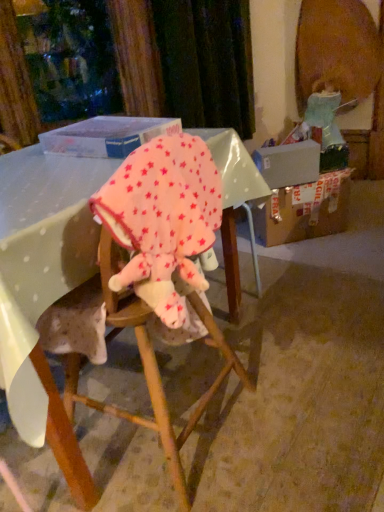
Where is `pink fleece baby elephant at center`? pink fleece baby elephant at center is located at coordinates (162, 219).

Image resolution: width=384 pixels, height=512 pixels. Describe the element at coordinates (304, 210) in the screenshot. I see `brown cardboard box at right` at that location.

The image size is (384, 512). What are the coordinates of `brown cardboard box at right` in the screenshot? It's located at [304, 210].

The width and height of the screenshot is (384, 512). I want to click on pink fleece blanket at center, so click(144, 350).

In the scene shown: How far apart are pink fleece blanket at center and translucent plastic box at upper center?

They are 21.10 inches apart.

Which of these two, pink fleece blanket at center or translucent plastic box at upper center, stands taller?

pink fleece blanket at center is taller.

Between pink fleece blanket at center and translucent plastic box at upper center, which one appears on the right side from the viewer's perspective?

pink fleece blanket at center.

Does pink fleece blanket at center lie behind translucent plastic box at upper center?

No, the depth of pink fleece blanket at center is less than that of translucent plastic box at upper center.

Consider the image. Is brown cardboard box at right to the right of pink fleece blanket at center from the viewer's perspective?

Indeed, brown cardboard box at right is positioned on the right side of pink fleece blanket at center.

Measure the distance from brown cardboard box at right to pink fleece blanket at center.

A distance of 3.69 feet exists between brown cardboard box at right and pink fleece blanket at center.

Is point (331, 202) behind point (184, 499)?

Yes, it is behind point (184, 499).

Is brown cardboard box at right directly adjacent to pink fleece blanket at center?

No, brown cardboard box at right is not next to pink fleece blanket at center.

Between brown cardboard box at right and pink fleece baby elephant at center, which one appears on the left side from the viewer's perspective?

Positioned to the left is pink fleece baby elephant at center.

Considering the relative sizes of brown cardboard box at right and pink fleece baby elephant at center in the image provided, is brown cardboard box at right thinner than pink fleece baby elephant at center?

No.

Does brown cardboard box at right have a smaller size compared to pink fleece baby elephant at center?

Actually, brown cardboard box at right might be larger than pink fleece baby elephant at center.

Does point (302, 187) come behind point (147, 289)?

Yes.

Can you confirm if pink fleece blanket at center is positioned to the right of brown cardboard box at right?

Incorrect, pink fleece blanket at center is not on the right side of brown cardboard box at right.

Considering the positions of points (217, 224) and (352, 170), is point (217, 224) closer to camera compared to point (352, 170)?

That is True.

Looking at this image, is pink fleece blanket at center oriented away from brown cardboard box at right?

That's not correct — pink fleece blanket at center is not looking away from brown cardboard box at right.

Based on the photo, from a real-world perspective, is pink fleece baby elephant at center on top of pink fleece blanket at center?

Yes.

Which object is wider, pink fleece baby elephant at center or pink fleece blanket at center?

With larger width is pink fleece blanket at center.

Is pink fleece baby elephant at center located outside pink fleece blanket at center?

No, most part of pink fleece baby elephant at center lies within pink fleece blanket at center.

Can you tell me how much pink fleece baby elephant at center and pink fleece blanket at center differ in facing direction?

The angular difference between pink fleece baby elephant at center and pink fleece blanket at center is 0.459 degrees.

Can we say pink fleece blanket at center lies outside pink fleece baby elephant at center?

That's correct, pink fleece blanket at center is outside of pink fleece baby elephant at center.

From a real-world perspective, between pink fleece blanket at center and pink fleece baby elephant at center, who is vertically higher?

pink fleece baby elephant at center is physically above.

Is pink fleece blanket at center next to pink fleece baby elephant at center?

No, pink fleece blanket at center is not in contact with pink fleece baby elephant at center.

Considering the relative positions of pink fleece blanket at center and pink fleece baby elephant at center in the image provided, is pink fleece blanket at center in front of pink fleece baby elephant at center?

No, pink fleece blanket at center is behind pink fleece baby elephant at center.

From a real-world perspective, is translucent plastic box at upper center positioned over pink fleece baby elephant at center based on gravity?

Yes.

Is translucent plastic box at upper center in front of or behind pink fleece baby elephant at center in the image?

Visually, translucent plastic box at upper center is located behind pink fleece baby elephant at center.

Between translucent plastic box at upper center and pink fleece baby elephant at center, which one has larger size?

With larger size is pink fleece baby elephant at center.

Which is closer to the camera, (75, 151) or (134, 177)?

Positioned in front is point (134, 177).

The image size is (384, 512). Identify the location of box that appears above the pink fleece blanket at center (from the image's perspective). (107, 136).

Identify the location of chair above the brown cardboard box at right (from a real-world perspective). This screenshot has width=384, height=512. (144, 350).

From the image, which object appears to be nearer to pink fleece blanket at center, translucent plastic box at upper center or pink fleece baby elephant at center?

pink fleece baby elephant at center lies closer to pink fleece blanket at center than the other object.

From the image, which object appears to be nearer to translucent plastic box at upper center, pink fleece blanket at center or brown cardboard box at right?

pink fleece blanket at center.

When comparing their distances from translucent plastic box at upper center, does brown cardboard box at right or pink fleece blanket at center seem closer?

pink fleece blanket at center lies closer to translucent plastic box at upper center than the other object.

Which object lies nearer to the anchor point pink fleece baby elephant at center, brown cardboard box at right or translucent plastic box at upper center?

The object closer to pink fleece baby elephant at center is translucent plastic box at upper center.

Which object lies nearer to the anchor point pink fleece baby elephant at center, pink fleece blanket at center or translucent plastic box at upper center?

Among the two, pink fleece blanket at center is located nearer to pink fleece baby elephant at center.

Looking at the image, which one is located closer to brown cardboard box at right, pink fleece blanket at center or translucent plastic box at upper center?

translucent plastic box at upper center lies closer to brown cardboard box at right than the other object.

Based on their spatial positions, is pink fleece baby elephant at center or translucent plastic box at upper center closer to brown cardboard box at right?

translucent plastic box at upper center is closer to brown cardboard box at right.

Based on their spatial positions, is pink fleece baby elephant at center or translucent plastic box at upper center closer to pink fleece blanket at center?

The object closer to pink fleece blanket at center is pink fleece baby elephant at center.

At what (x,y) coordinates should I click in order to perform the action: click on chair positioned between pink fleece baby elephant at center and translucent plastic box at upper center from near to far. Please return your answer as a coordinate pair (x, y). The height and width of the screenshot is (512, 384). Looking at the image, I should click on (144, 350).

The image size is (384, 512). Identify the location of box between pink fleece baby elephant at center and brown cardboard box at right from front to back. (107, 136).

In order to click on chair between pink fleece baby elephant at center and brown cardboard box at right from front to back in this screenshot , I will do `click(144, 350)`.

Where is `box between pink fleece blanket at center and brown cardboard box at right from front to back`? box between pink fleece blanket at center and brown cardboard box at right from front to back is located at coordinates point(107,136).